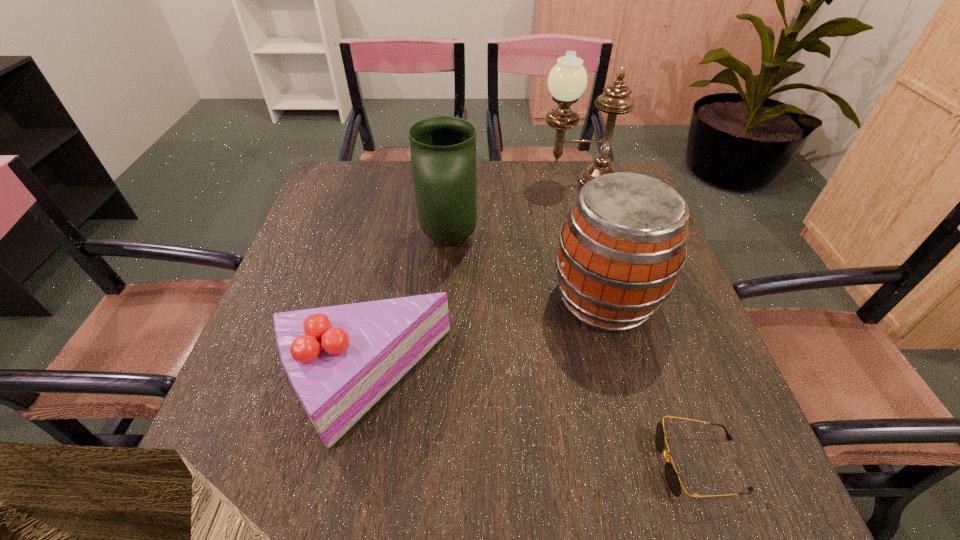
The image size is (960, 540). Identify the location of object that is at the near right corner. tap(672, 477).

What are the coordinates of `vacant space at the far edge` in the screenshot? It's located at (401, 197).

The width and height of the screenshot is (960, 540). I want to click on vacant space at the near edge of the desktop, so click(x=345, y=487).

In the image, there is a desktop. Identify the location of vacant space at the left edge. The height and width of the screenshot is (540, 960). (300, 420).

In order to click on vacant region at the right edge of the desktop in this screenshot , I will do `click(659, 378)`.

Locate an element on the screen. The height and width of the screenshot is (540, 960). vacant position at the near left corner of the desktop is located at coordinates click(266, 472).

Image resolution: width=960 pixels, height=540 pixels. In the image, there is a desktop. Identify the location of free space at the near right corner. (689, 464).

At what (x,y) coordinates should I click in order to perform the action: click on unoccupied position between the cake and the cider. Please return your answer as a coordinate pair (x, y). The width and height of the screenshot is (960, 540). Looking at the image, I should click on (484, 341).

You are a GUI agent. You are given a task and a screenshot of the screen. Output one action in this format:
    pyautogui.click(x=<x>, y=<y>)
    Task: Click on the vacant region between the shortest object and the cider
    
    Given the screenshot: What is the action you would take?
    pyautogui.click(x=653, y=382)

Locate an element on the screen. This screenshot has height=540, width=960. unoccupied position between the vase and the farthest object is located at coordinates (514, 210).